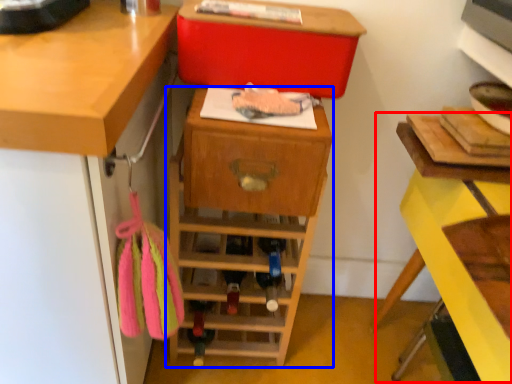
Question: Which point is further to the camera, computer desk (highlighted by a red box) or shelf (highlighted by a blue box)?

Choices:
 (A) computer desk
 (B) shelf

Answer: (B)